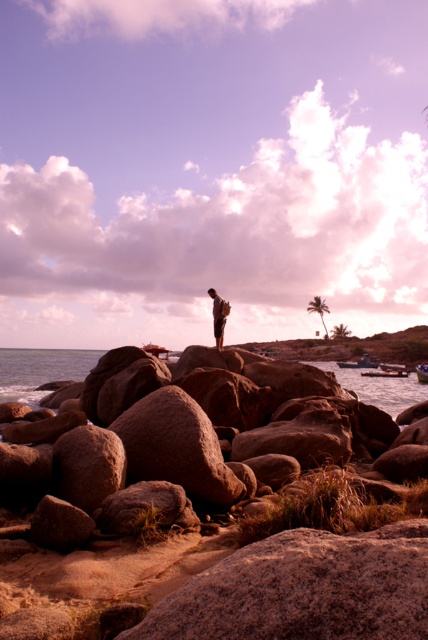
Question: Which object appears farthest from the camera in this image?

Choices:
 (A) smooth brown water at center
 (B) brown leather backpack at center
 (C) green leafy palm tree at center-right
 (D) green leafy palm tree at upper right

Answer: (C)

Question: Among these points, which one is farthest from the camera?

Choices:
 (A) (315, 310)
 (B) (225, 321)
 (C) (86, 358)

Answer: (A)

Question: Is green leafy palm tree at upper right below green leafy palm tree at center-right?

Choices:
 (A) yes
 (B) no

Answer: (B)

Question: Is smooth brown water at center closer to camera compared to green leafy palm tree at center-right?

Choices:
 (A) yes
 (B) no

Answer: (A)

Question: Which point is closer to the camera taking this photo?

Choices:
 (A) (225, 310)
 (B) (321, 317)
 (C) (404, 381)
 (D) (336, 332)

Answer: (A)

Question: Can you confirm if smooth brown water at center is positioned to the left of green leafy palm tree at center-right?

Choices:
 (A) yes
 (B) no

Answer: (A)